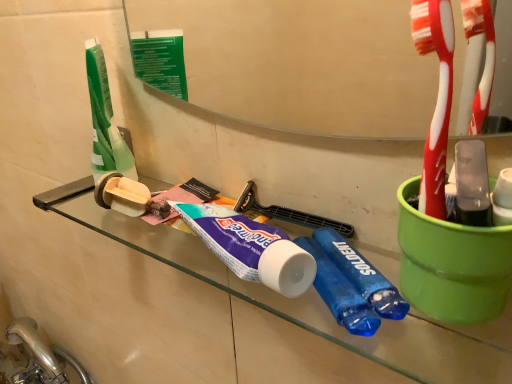
Question: Are beige cardboard toilet paper at left and satin nickel faucet at lower left beside each other?

Choices:
 (A) yes
 (B) no

Answer: (B)

Question: Considering the relative positions of beige cardboard toilet paper at left and satin nickel faucet at lower left in the image provided, is beige cardboard toilet paper at left to the right of satin nickel faucet at lower left from the viewer's perspective?

Choices:
 (A) yes
 (B) no

Answer: (A)

Question: Is beige cardboard toilet paper at left closer to camera compared to satin nickel faucet at lower left?

Choices:
 (A) yes
 (B) no

Answer: (A)

Question: From a real-world perspective, is beige cardboard toilet paper at left over satin nickel faucet at lower left?

Choices:
 (A) yes
 (B) no

Answer: (A)

Question: Is beige cardboard toilet paper at left bigger than satin nickel faucet at lower left?

Choices:
 (A) yes
 (B) no

Answer: (B)

Question: Would you say transparent glass shelf at center is inside or outside beige cardboard toilet paper at left?

Choices:
 (A) outside
 (B) inside

Answer: (A)

Question: Considering their positions, is transparent glass shelf at center located in front of or behind beige cardboard toilet paper at left?

Choices:
 (A) behind
 (B) front

Answer: (B)

Question: From a real-world perspective, is transparent glass shelf at center positioned above or below beige cardboard toilet paper at left?

Choices:
 (A) above
 (B) below

Answer: (B)

Question: Would you say transparent glass shelf at center is to the left or to the right of beige cardboard toilet paper at left in the picture?

Choices:
 (A) right
 (B) left

Answer: (A)

Question: Is point (117, 175) positioned closer to the camera than point (209, 226)?

Choices:
 (A) closer
 (B) farther

Answer: (B)

Question: From the image's perspective, is beige cardboard toilet paper at left positioned above or below purple matte toothpaste at center?

Choices:
 (A) above
 (B) below

Answer: (A)

Question: In terms of height, does beige cardboard toilet paper at left look taller or shorter compared to purple matte toothpaste at center?

Choices:
 (A) tall
 (B) short

Answer: (B)

Question: Would you say beige cardboard toilet paper at left is inside or outside purple matte toothpaste at center?

Choices:
 (A) inside
 (B) outside

Answer: (B)

Question: Considering the positions of beige cardboard toilet paper at left and satin nickel faucet at lower left in the image, is beige cardboard toilet paper at left wider or thinner than satin nickel faucet at lower left?

Choices:
 (A) wide
 (B) thin

Answer: (B)

Question: From a real-world perspective, is beige cardboard toilet paper at left positioned above or below satin nickel faucet at lower left?

Choices:
 (A) below
 (B) above

Answer: (B)